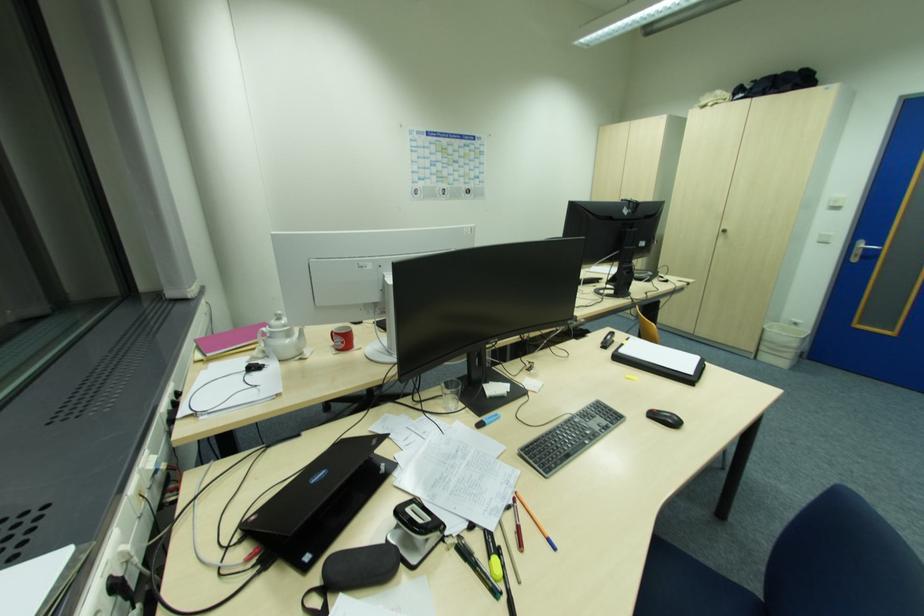
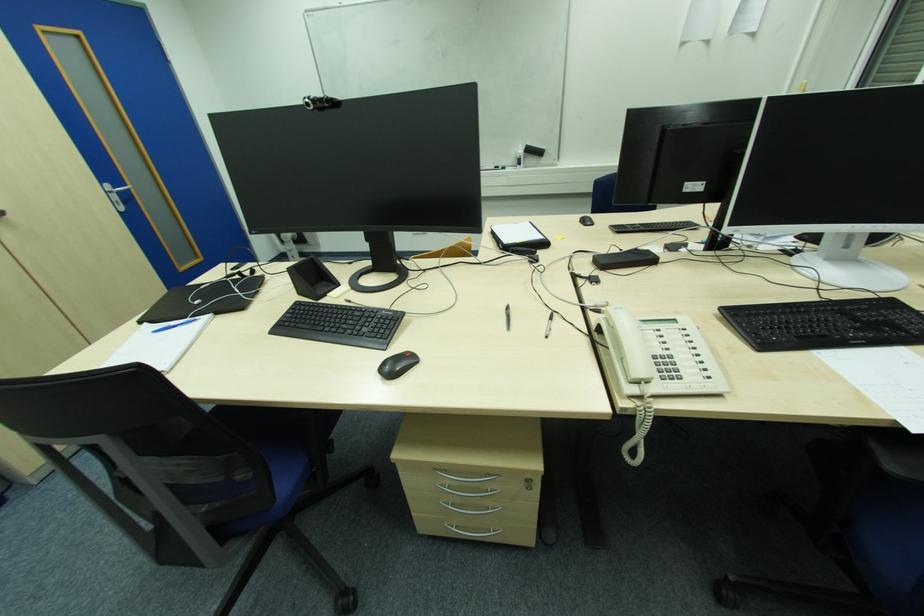
Locate, in the second image, the point that corresponds to point (858, 256) in the first image.

(119, 204)